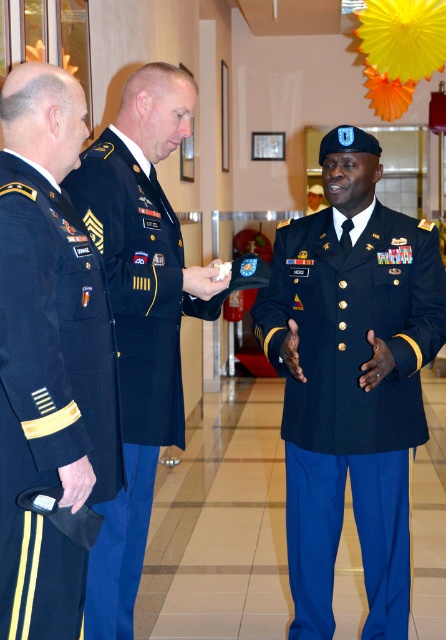
Question: Does navy blue uniform at center have a greater width compared to navy blue fabric uniform at left?

Choices:
 (A) yes
 (B) no

Answer: (A)

Question: Is navy blue uniform at center wider than navy blue fabric uniform at center?

Choices:
 (A) no
 (B) yes

Answer: (B)

Question: Is navy blue uniform at center below navy blue fabric uniform at left?

Choices:
 (A) no
 (B) yes

Answer: (B)

Question: Which point appears closest to the camera in this image?

Choices:
 (A) pos(33,352)
 (B) pos(132,321)

Answer: (A)

Question: Which point is farther to the camera?

Choices:
 (A) (314, 316)
 (B) (131, 536)
 (C) (1, 273)

Answer: (B)

Question: Which object appears farthest from the camera in this image?

Choices:
 (A) navy blue fabric uniform at center
 (B) navy blue uniform at center
 (C) navy blue fabric uniform at left

Answer: (B)